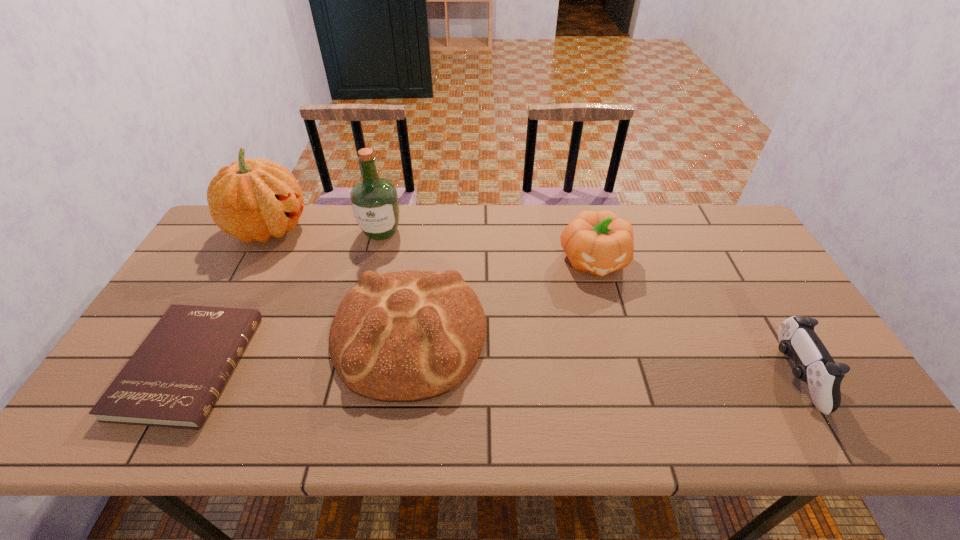
Identify the location of vacant area situated on the left of the bread. This screenshot has width=960, height=540. (188, 335).

Identify the location of vacant space located on the front-facing side of the control. The height and width of the screenshot is (540, 960). (643, 376).

The height and width of the screenshot is (540, 960). I want to click on vacant area situated on the front-facing side of the control, so click(x=750, y=376).

Find the location of `free spot located on the front-facing side of the control`. free spot located on the front-facing side of the control is located at coordinates (676, 376).

You are a GUI agent. You are given a task and a screenshot of the screen. Output one action in this format:
    pyautogui.click(x=<x>, y=<y>)
    Task: Click on the vacant space located on the back of the hardback book
    The width and height of the screenshot is (960, 540).
    Given the screenshot: What is the action you would take?
    pyautogui.click(x=240, y=273)

This screenshot has height=540, width=960. I want to click on liquor situated at the far edge, so click(374, 200).

The image size is (960, 540). What are the coordinates of `control present at the near edge` in the screenshot? It's located at (x=797, y=339).

The width and height of the screenshot is (960, 540). Identify the location of hardback book at the near edge. (173, 379).

Where is `pumpkin situated at the left edge`? The image size is (960, 540). pumpkin situated at the left edge is located at coordinates (251, 200).

The image size is (960, 540). In order to click on hardback book present at the left edge in this screenshot , I will do `click(173, 379)`.